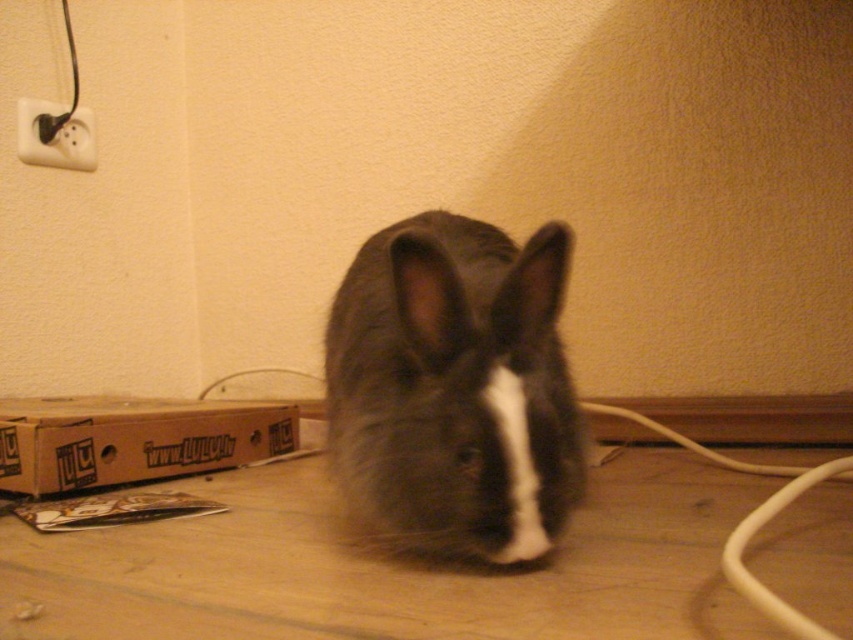
You are holding a camera and want to take a closeup photo of the fuzzy gray rabbit at center. The camera requires the subject to be at least 60 centimeters away to avoid blurring. Can you take the photo from your current position?

The fuzzy gray rabbit at center is only 53.61 centimeters away from the camera, which is less than the required 60 centimeters. Therefore, taking the photo from the current position would result in blurring.

You are a small toy mouse that needs to hide behind either the brown cardboard box at lower left or the white plastic electric outlet at upper left. Which one can you hide behind without being seen from the front?

The brown cardboard box at lower left is bigger than the white plastic electric outlet at upper left, so you can hide behind the brown cardboard box at lower left without being seen from the front.